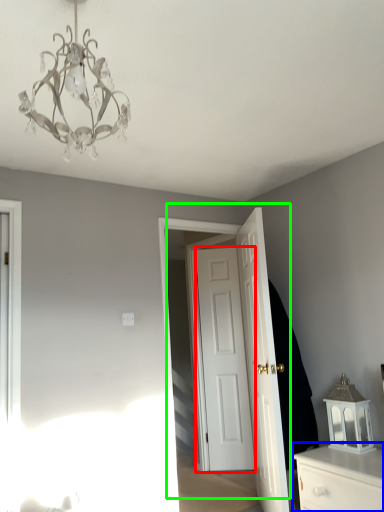
Question: Estimate the real-world distances between objects in this image. Which object is closer to door (highlighted by a red box), chest of drawers (highlighted by a blue box) or door (highlighted by a green box)?

Choices:
 (A) chest of drawers
 (B) door

Answer: (B)